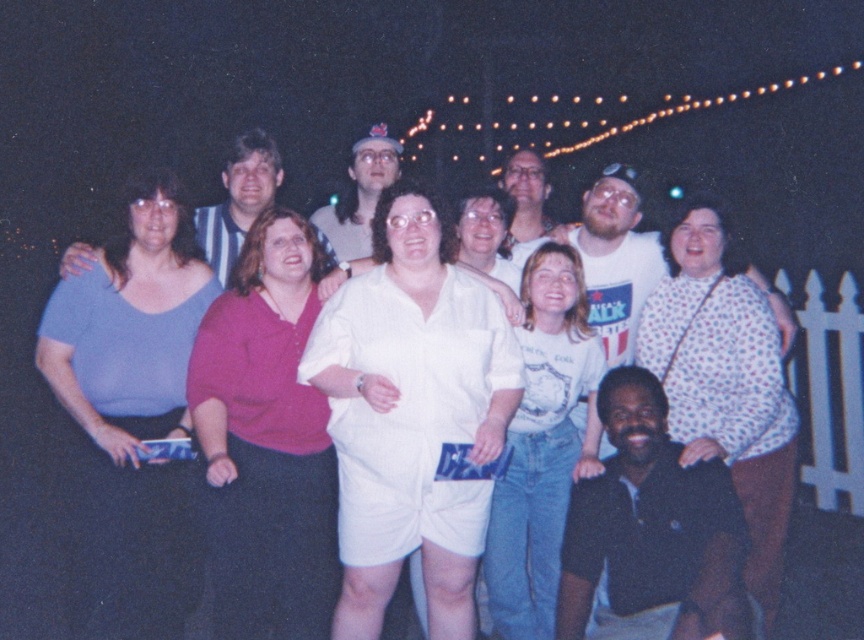
Is white cotton t-shirt at center above matte blue shirt at left?

No.

What do you see at coordinates (542, 445) in the screenshot? Image resolution: width=864 pixels, height=640 pixels. I see `white cotton t-shirt at center` at bounding box center [542, 445].

What are the coordinates of `white cotton t-shirt at center` in the screenshot? It's located at (542, 445).

Does white pinstripe shorts at center come in front of matte pink blouse at center?

Yes, it is in front of matte pink blouse at center.

Does white pinstripe shorts at center appear over matte pink blouse at center?

Yes, white pinstripe shorts at center is above matte pink blouse at center.

Identify the location of white pinstripe shorts at center. The height and width of the screenshot is (640, 864). (x=411, y=413).

Which of these two, matte blue blouse at center or matte blue shirt at left, stands shorter?

With less height is matte blue shirt at left.

Who is positioned more to the left, matte blue blouse at center or matte blue shirt at left?

matte blue blouse at center

Where is `matte blue blouse at center`? This screenshot has width=864, height=640. matte blue blouse at center is located at coordinates (132, 404).